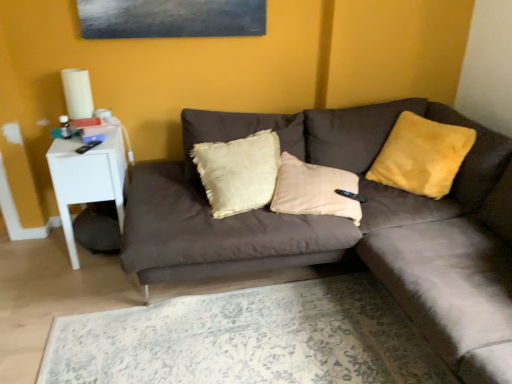
Question: Does velvet brown couch at center have a greater width compared to white glossy side table at left?

Choices:
 (A) yes
 (B) no

Answer: (A)

Question: From the image's perspective, is velvet brown couch at center on top of white glossy side table at left?

Choices:
 (A) no
 (B) yes

Answer: (A)

Question: From a real-world perspective, is velvet brown couch at center on top of white glossy side table at left?

Choices:
 (A) no
 (B) yes

Answer: (B)

Question: Does velvet brown couch at center have a larger size compared to white glossy side table at left?

Choices:
 (A) no
 (B) yes

Answer: (B)

Question: Considering the relative positions of velvet brown couch at center and white glossy side table at left in the image provided, is velvet brown couch at center to the left of white glossy side table at left from the viewer's perspective?

Choices:
 (A) yes
 (B) no

Answer: (B)

Question: Considering their positions, is white glossy side table at left located in front of or behind yellow fuzzy pillow at upper right?

Choices:
 (A) behind
 (B) front

Answer: (A)

Question: Considering the positions of white glossy side table at left and yellow fuzzy pillow at upper right in the image, is white glossy side table at left wider or thinner than yellow fuzzy pillow at upper right?

Choices:
 (A) wide
 (B) thin

Answer: (A)

Question: Is point click(54, 190) positioned closer to the camera than point click(403, 127)?

Choices:
 (A) closer
 (B) farther

Answer: (B)

Question: From a real-world perspective, is white glossy side table at left above or below yellow fuzzy pillow at upper right?

Choices:
 (A) above
 (B) below

Answer: (B)

Question: Based on their positions, is velvet brown couch at center located to the left or right of white glossy side table at left?

Choices:
 (A) right
 (B) left

Answer: (A)

Question: From a real-world perspective, is velvet brown couch at center physically located above or below white glossy side table at left?

Choices:
 (A) above
 (B) below

Answer: (A)

Question: Which is correct: velvet brown couch at center is inside white glossy side table at left, or outside of it?

Choices:
 (A) outside
 (B) inside

Answer: (A)

Question: Is point (412, 316) closer or farther from the camera than point (58, 142)?

Choices:
 (A) farther
 (B) closer

Answer: (B)

Question: In terms of height, does white glossy side table at left look taller or shorter compared to velvet brown couch at center?

Choices:
 (A) tall
 (B) short

Answer: (A)

Question: Looking at their shapes, would you say white glossy side table at left is wider or thinner than velvet brown couch at center?

Choices:
 (A) thin
 (B) wide

Answer: (A)